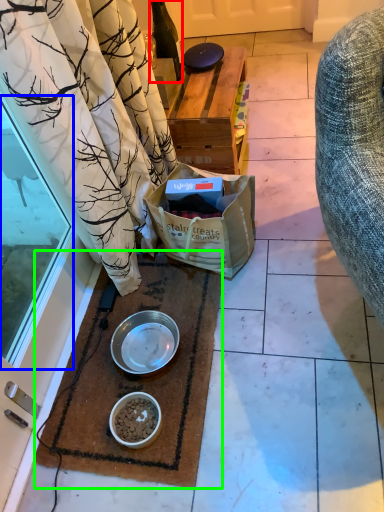
Question: Which is nearer to the bottle (highlighted by a red box)? glass door (highlighted by a blue box) or mat (highlighted by a green box).

Choices:
 (A) glass door
 (B) mat

Answer: (A)